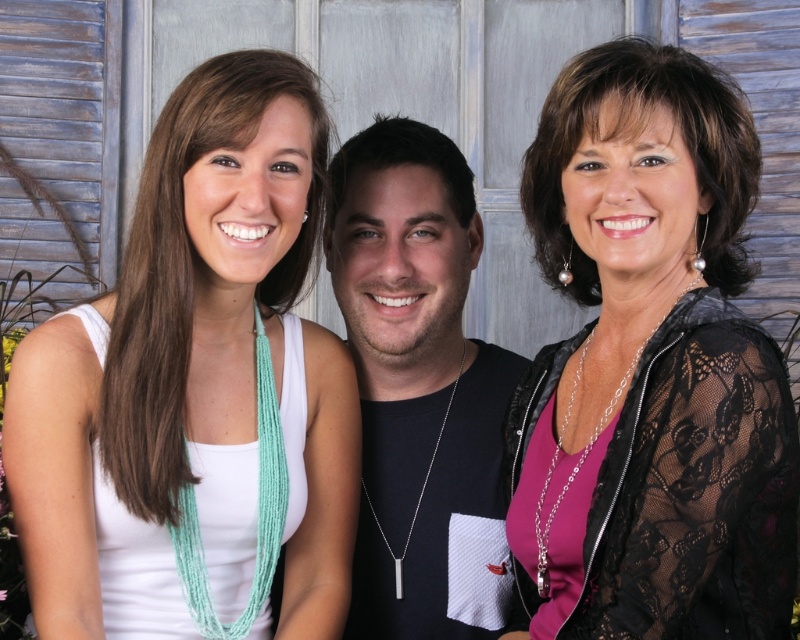
Can you confirm if white fabric tank top at left is shorter than pink lace jacket at upper right?

Yes, white fabric tank top at left is shorter than pink lace jacket at upper right.

Is point (312, 432) in front of point (528, 396)?

No.

Identify the location of white fabric tank top at left. (196, 390).

Which is behind, point (670, 209) or point (464, 506)?

Positioned behind is point (464, 506).

Does pink lace jacket at upper right have a lesser height compared to black matte shirt at center?

Yes.

Is point (782, 609) farther from viewer compared to point (382, 316)?

No, (782, 609) is closer to viewer.

I want to click on pink lace jacket at upper right, so click(649, 365).

In the scene shown: Does white fabric tank top at left appear on the left side of black matte shirt at center?

Yes, white fabric tank top at left is to the left of black matte shirt at center.

Is point (302, 497) less distant than point (505, 403)?

Yes, point (302, 497) is closer to viewer.

Is point (48, 417) in front of point (338, 198)?

Yes, it is in front of point (338, 198).

You are a GUI agent. You are given a task and a screenshot of the screen. Output one action in this format:
    pyautogui.click(x=<x>, y=<y>)
    Task: Click on the white fabric tank top at left
    The image size is (800, 640).
    Given the screenshot: What is the action you would take?
    pyautogui.click(x=196, y=390)